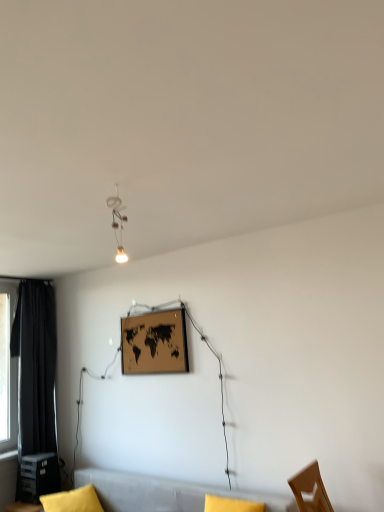
Question: Is matte black plastic table at lower left thinner than wooden map at center?

Choices:
 (A) no
 (B) yes

Answer: (A)

Question: Is matte black plastic table at lower left further to the viewer compared to wooden map at center?

Choices:
 (A) yes
 (B) no

Answer: (A)

Question: From the image's perspective, does matte black plastic table at lower left appear lower than wooden map at center?

Choices:
 (A) yes
 (B) no

Answer: (A)

Question: Is matte black plastic table at lower left next to wooden map at center and touching it?

Choices:
 (A) no
 (B) yes

Answer: (A)

Question: From a real-world perspective, is matte black plastic table at lower left physically above wooden map at center?

Choices:
 (A) yes
 (B) no

Answer: (B)

Question: Is matte black plastic table at lower left positioned in front of wooden map at center?

Choices:
 (A) no
 (B) yes

Answer: (A)

Question: Does yellow fabric pillow at lower left have a lesser width compared to black fabric curtain at left?

Choices:
 (A) yes
 (B) no

Answer: (B)

Question: From the image's perspective, is yellow fabric pillow at lower left under black fabric curtain at left?

Choices:
 (A) yes
 (B) no

Answer: (A)

Question: Is yellow fabric pillow at lower left to the right of black fabric curtain at left from the viewer's perspective?

Choices:
 (A) no
 (B) yes

Answer: (B)

Question: Is yellow fabric pillow at lower left looking in the opposite direction of black fabric curtain at left?

Choices:
 (A) yes
 (B) no

Answer: (A)

Question: Can you confirm if yellow fabric pillow at lower left is positioned to the left of black fabric curtain at left?

Choices:
 (A) yes
 (B) no

Answer: (B)

Question: Is the depth of yellow fabric pillow at lower left less than that of black fabric curtain at left?

Choices:
 (A) yes
 (B) no

Answer: (A)

Question: From the image's perspective, is matte black plastic table at lower left under soft gray couch at lower center?

Choices:
 (A) no
 (B) yes

Answer: (B)